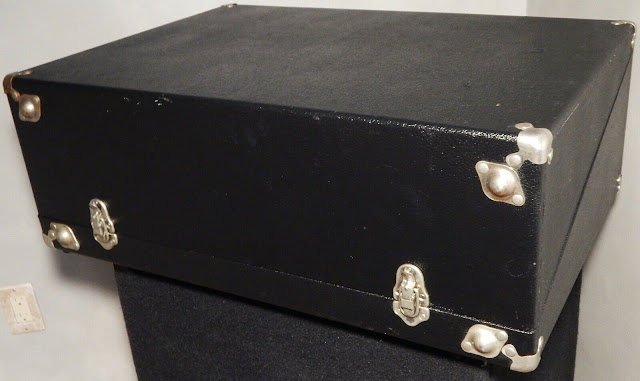
At what (x,y) coordinates should I click in order to perform the action: click on electrical outlet. Please return your answer as a coordinate pair (x, y). The width and height of the screenshot is (640, 381). Looking at the image, I should click on (22, 306).